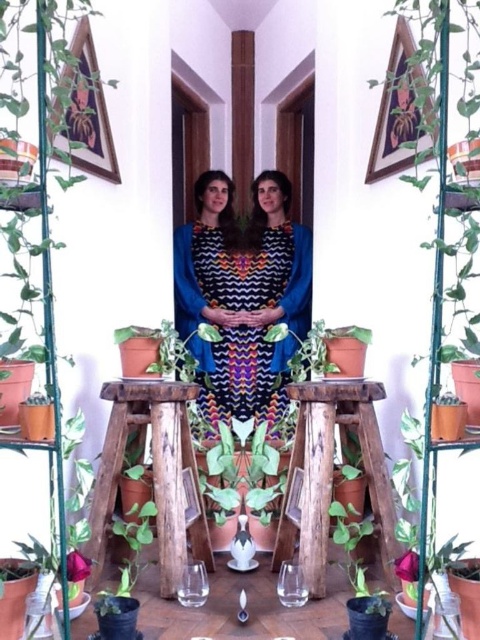
You are a delivery person who needs to place a small package between the wooden stool at center and the green matte plant at lower left. Can the package fit in the space between them?

The wooden stool at center and green matte plant at lower left are 6.50 inches apart, so the package can fit in the space between them if it is less than 6.50 inches wide.